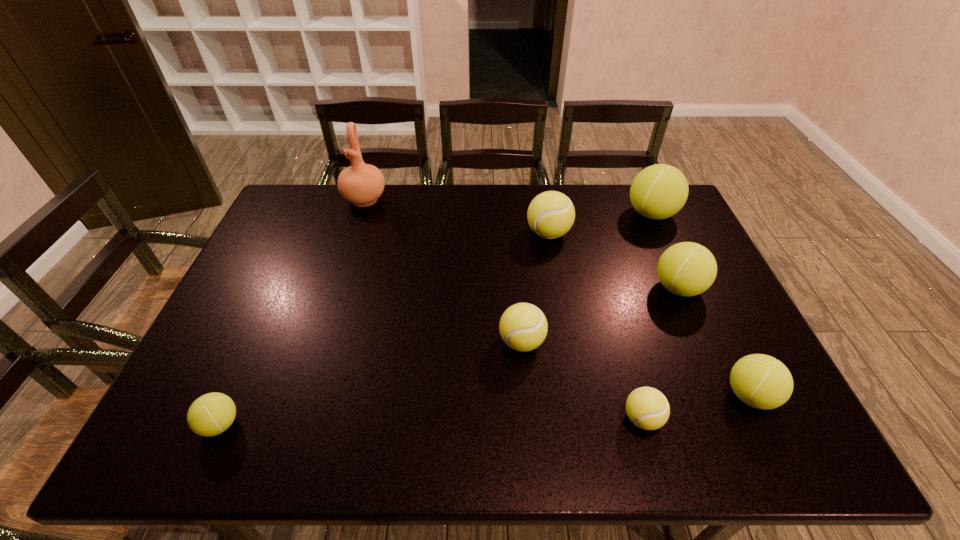
Locate an element on the screen. The image size is (960, 540). the fourth tennis ball from left to right is located at coordinates (647, 408).

You are a GUI agent. You are given a task and a screenshot of the screen. Output one action in this format:
    pyautogui.click(x=<x>, y=<y>)
    Task: Click on the smallest yellow tennis ball
    The image size is (960, 540).
    Given the screenshot: What is the action you would take?
    pyautogui.click(x=647, y=408)

The width and height of the screenshot is (960, 540). What are the coordinates of `the smallest green tennis ball` in the screenshot? It's located at (211, 414).

Find the location of `the leftmost object`. the leftmost object is located at coordinates pyautogui.click(x=211, y=414).

Where is `vacant space located 0.240m on the spout of the tallest object`? vacant space located 0.240m on the spout of the tallest object is located at coordinates (346, 260).

Locate an element on the screen. The width and height of the screenshot is (960, 540). vacant space located on the front of the farthest green tennis ball is located at coordinates (684, 287).

I want to click on free space located on the left of the farthest yellow tennis ball, so click(x=446, y=233).

This screenshot has height=540, width=960. Find the location of `free space located 0.130m on the front of the third farthest tennis ball`. free space located 0.130m on the front of the third farthest tennis ball is located at coordinates (704, 346).

Find the location of a particular element. This screenshot has width=960, height=540. free region located on the right of the second smallest yellow tennis ball is located at coordinates (654, 342).

Identify the location of vacant point located 0.090m on the back of the second smallest green tennis ball. Image resolution: width=960 pixels, height=540 pixels. (725, 343).